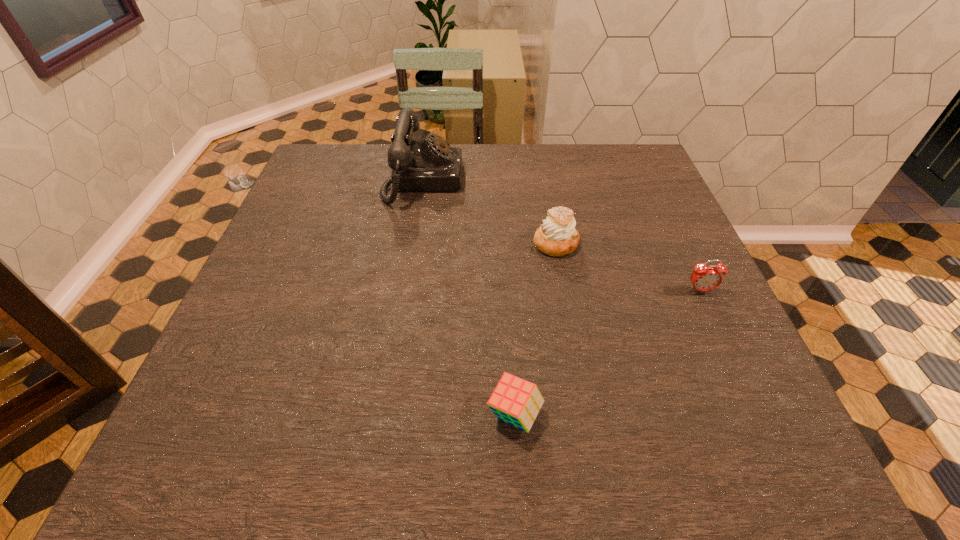
You are a GUI agent. You are given a task and a screenshot of the screen. Output one action in this format:
    pyautogui.click(x=<x>, y=<y>)
    Task: Click on the vacant area situated on the face of the second nearest object
    
    Given the screenshot: What is the action you would take?
    pyautogui.click(x=764, y=428)

At what (x,y) coordinates should I click in order to perform the action: click on vacant space located on the left of the cube. Please return your answer as a coordinate pair (x, y). The height and width of the screenshot is (540, 960). Looking at the image, I should click on (272, 415).

Find the location of `object that is at the far edge`. object that is at the far edge is located at coordinates (431, 164).

At what (x,y) coordinates should I click in order to perform the action: click on object present at the near edge. Please return your answer as a coordinate pair (x, y). Looking at the image, I should click on (515, 401).

In order to click on object located in the right edge section of the desktop in this screenshot , I will do `click(704, 278)`.

In the image, there is a desktop. Where is `vacant space at the far edge`? This screenshot has width=960, height=540. vacant space at the far edge is located at coordinates (545, 171).

Identify the location of free space at the near edge of the desktop. This screenshot has height=540, width=960. (367, 441).

This screenshot has width=960, height=540. Identify the location of vacant space at the left edge of the desktop. (313, 309).

This screenshot has width=960, height=540. In the image, there is a desktop. What are the coordinates of `vacant space at the right edge` in the screenshot? It's located at (661, 285).

I want to click on empty space between the third object from right to left and the farthest object, so click(x=469, y=298).